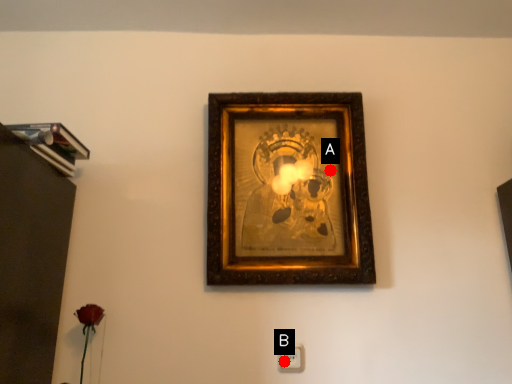
Question: Two points are circled on the image, labeled by A and B beside each circle. Which point is farther from the camera taking this photo?

Choices:
 (A) A is further
 (B) B is further

Answer: (A)